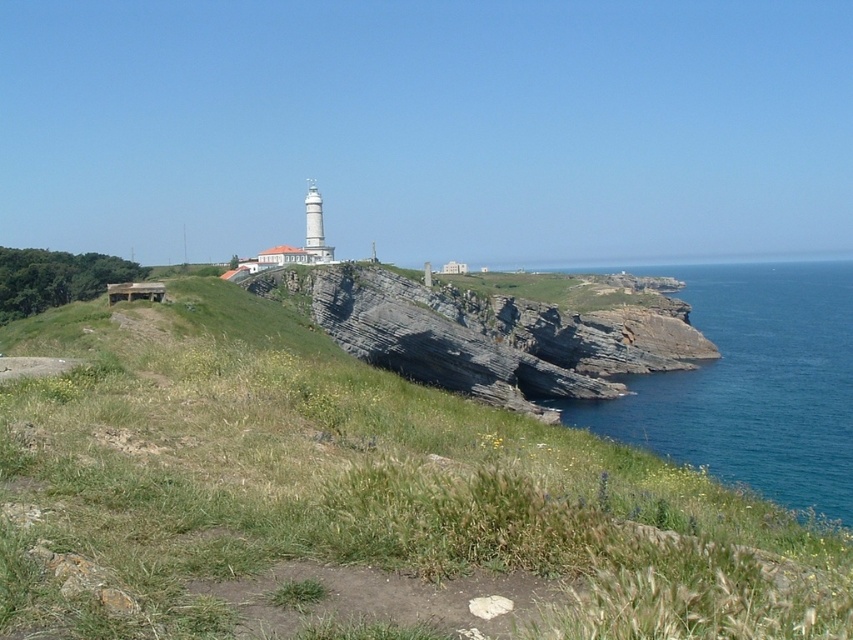
You are a hiker planning to cross the area between the green grassy at center and the rocky cliff at center. Considering their widths, which one would you prefer to walk on and why?

The green grassy at center has a lesser width compared to the rocky cliff at center. Therefore, the rocky cliff at center is wider, making it a more stable and safer path for walking.

You are a bird flying over the coastal landscape. You see the green grassy at center and the blue water at right. Which one is located lower in the scene?

The green grassy at center is located lower than the blue water at right because it is positioned below it in the scene.

You are standing at the base of the cliff looking up at the lighthouse and the surrounding area. There are two points marked on the cliff face. The first point is located at coordinates point (792,355) and the second at point (492,388). Which of these points is higher up on the cliff face?

Point (792,355) is higher up on the cliff face than point (492,388) because it is positioned behind the latter, indicating a higher elevation.